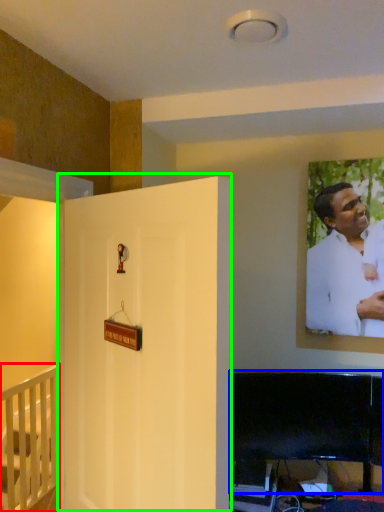
Question: Estimate the real-world distances between objects in this image. Which object is farther from furniture (highlighted by a red box), furniture (highlighted by a blue box) or door (highlighted by a green box)?

Choices:
 (A) furniture
 (B) door

Answer: (B)